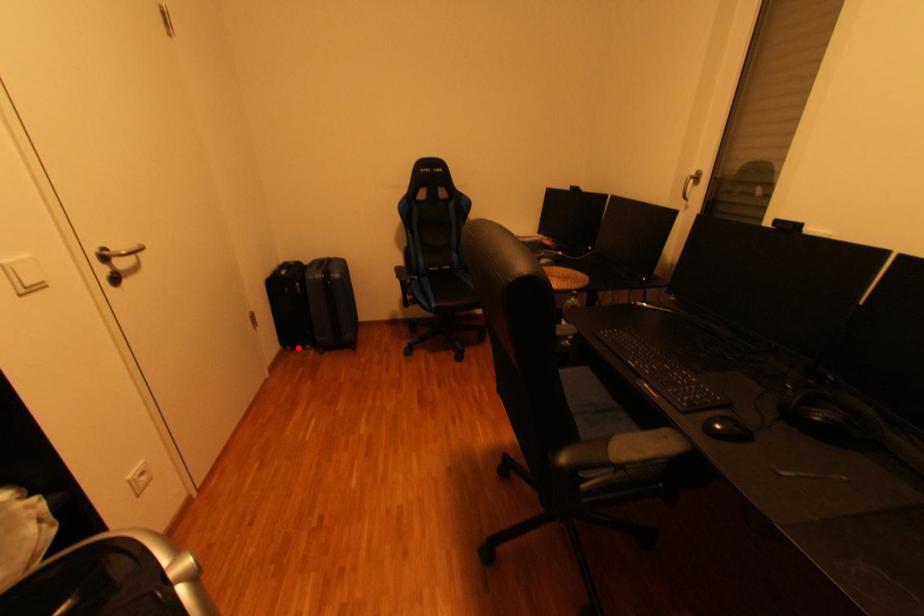
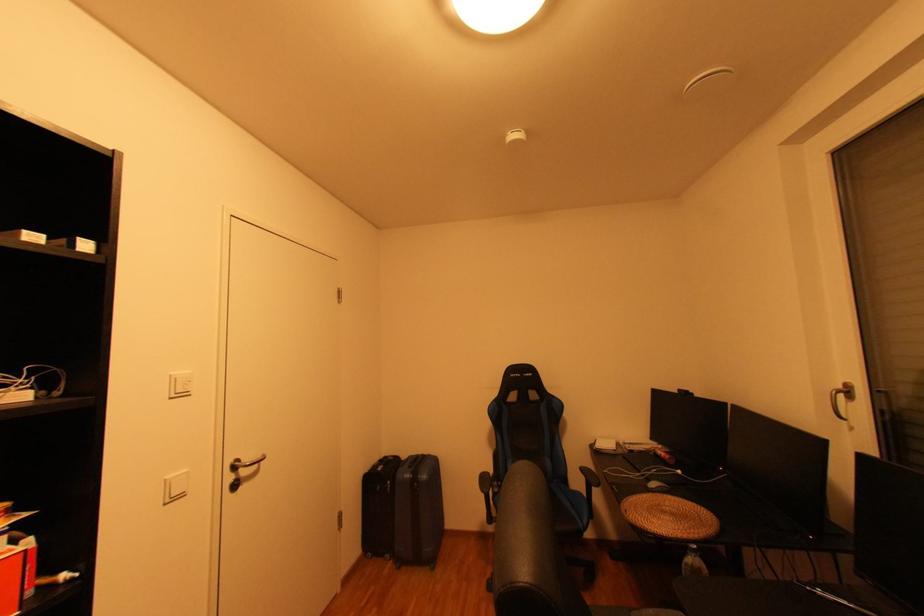
Where in the second image is the point corresponding to the highlighted location from the first image?

(380, 554)